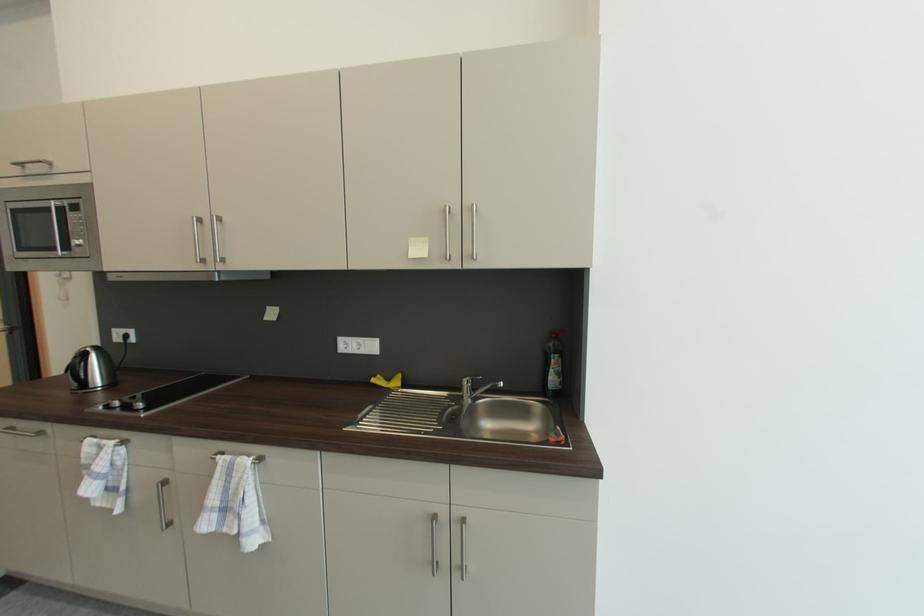
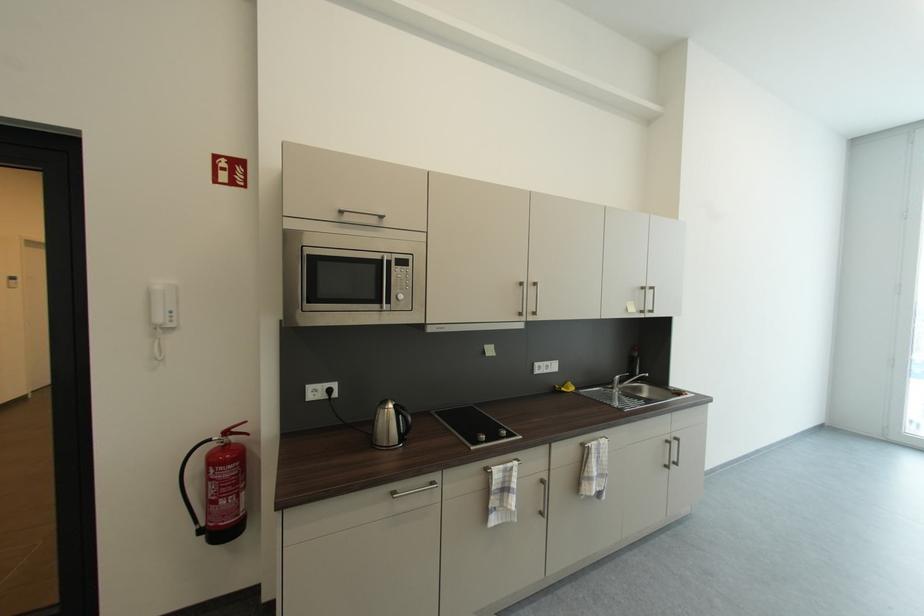
Where in the second image is the point corresponding to [450,517] from the first image?

(675, 440)